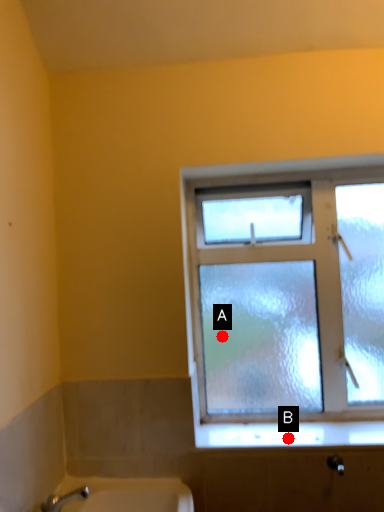
Question: Two points are circled on the image, labeled by A and B beside each circle. Which point is farther to the camera?

Choices:
 (A) A is further
 (B) B is further

Answer: (A)